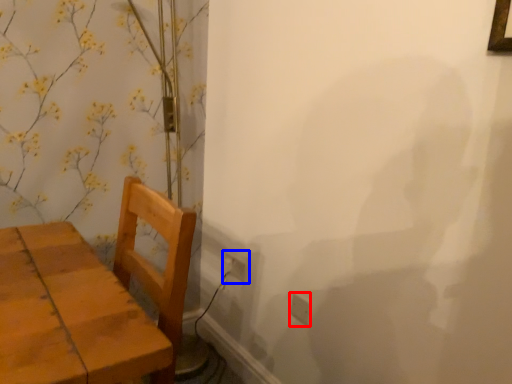
Question: Which of the following is the farthest to the observer, electric outlet (highlighted by a red box) or electric outlet (highlighted by a blue box)?

Choices:
 (A) electric outlet
 (B) electric outlet

Answer: (B)